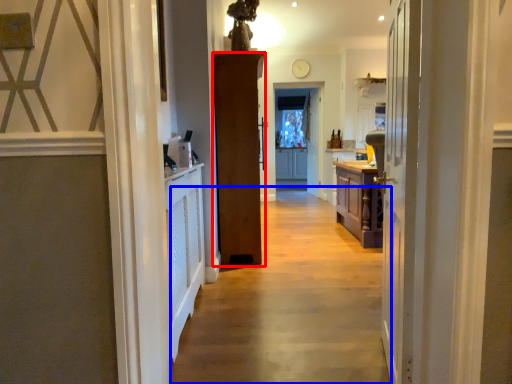
Question: Which object is further to the camera taking this photo, door (highlighted by a red box) or path (highlighted by a blue box)?

Choices:
 (A) door
 (B) path

Answer: (A)